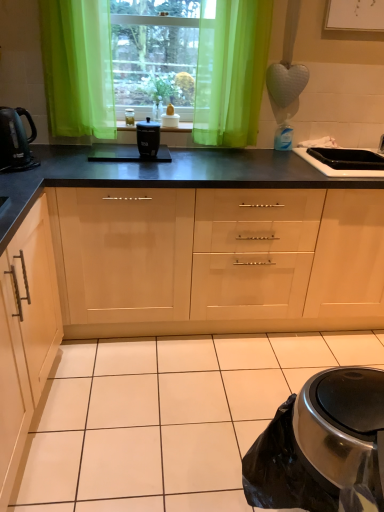
Question: From the image's perspective, is black matte slow cooker at center located above or below light wood/finish cabinet at left, the 2th cabinetry in the right-to-left sequence?

Choices:
 (A) below
 (B) above

Answer: (B)

Question: In the image, is black matte slow cooker at center positioned in front of or behind light wood/finish cabinet at left, which appears as the 1th cabinetry when viewed from the left?

Choices:
 (A) front
 (B) behind

Answer: (B)

Question: Which of these objects is positioned closest to the black glossy sink at right?

Choices:
 (A) shiny black kettle at left
 (B) black plastic container at center
 (C) translucent green curtain at center
 (D) green sheer curtain at center
 (E) light wood/finish cabinet at left, the 2th cabinetry in the right-to-left sequence

Answer: (D)

Question: Which of these objects is positioned farthest from the translucent green curtain at center?

Choices:
 (A) black glossy sink at right
 (B) shiny black kettle at left
 (C) black matte slow cooker at center
 (D) matte wood cabinets at center, which ranks as the 2th cabinetry in left-to-right order
 (E) green sheer curtain at center

Answer: (D)